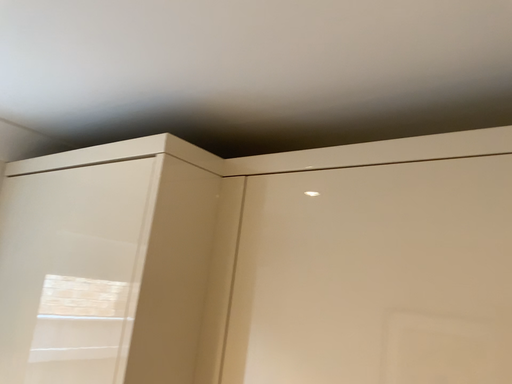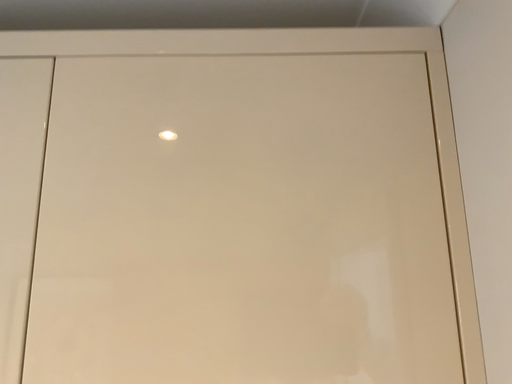
Question: Which way did the camera rotate in the video?

Choices:
 (A) rotated right
 (B) rotated left

Answer: (A)